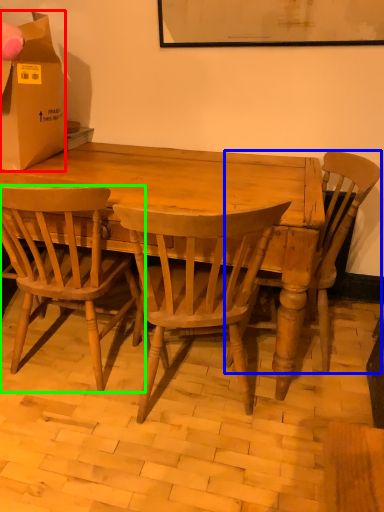
Question: Which object is the farthest from box (highlighted by a red box)? Choose among these: chair (highlighted by a blue box) or chair (highlighted by a green box).

Choices:
 (A) chair
 (B) chair

Answer: (A)